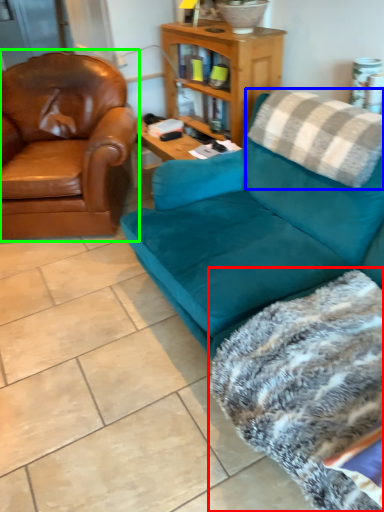
Question: Based on their relative distances, which object is nearer to blanket (highlighted by a red box)? Choose from pillow (highlighted by a blue box) and chair (highlighted by a green box).

Choices:
 (A) pillow
 (B) chair

Answer: (A)